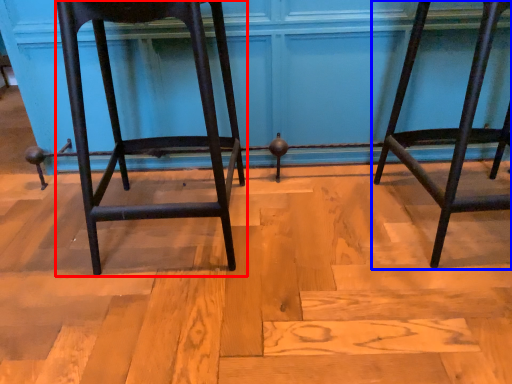
Question: Which of the following is the farthest to the observer, furniture (highlighted by a red box) or furniture (highlighted by a blue box)?

Choices:
 (A) furniture
 (B) furniture

Answer: (B)